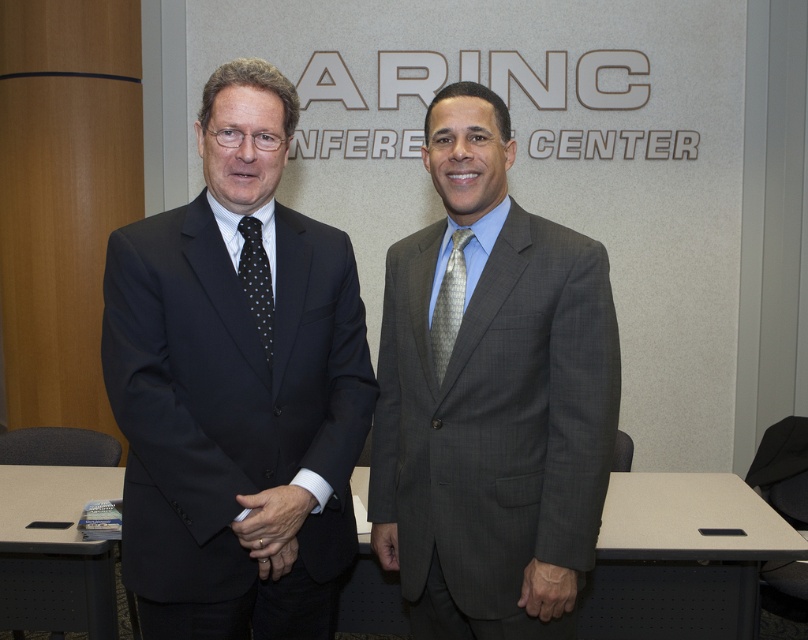
You are organizing a conference and need to ensure that the matte black suit at left and the gray textured tie at center can both fit on a display stand. The stand has a maximum width capacity of 1.2 meters. Can both items be placed on the stand together?

The matte black suit at left is bigger than the gray textured tie at center, but the combined size of both items is not specified. Without knowing the exact dimensions of each, it is impossible to determine if they will fit on the stand together.